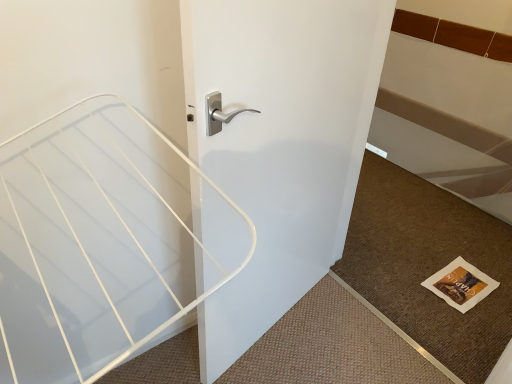
In order to face brown textured mat at lower right, should I rotate leftwards or rightwards?

To face it directly, rotate right by 19.621 degrees.

Image resolution: width=512 pixels, height=384 pixels. Describe the element at coordinates (428, 265) in the screenshot. I see `brown textured mat at lower right` at that location.

What is the approximate width of brown textured mat at lower right?

It is 3.42 feet.

Where is `brown textured mat at lower right`? This screenshot has width=512, height=384. brown textured mat at lower right is located at coordinates (428, 265).

Measure the distance between point (378, 277) and camera.

A distance of 6.25 feet exists between point (378, 277) and camera.

What is the approximate height of white glossy door handle at center?

white glossy door handle at center is 1.20 meters tall.

Find the location of `white glossy door handle at center`. white glossy door handle at center is located at coordinates (280, 144).

The height and width of the screenshot is (384, 512). What do you see at coordinates (280, 144) in the screenshot?
I see `white glossy door handle at center` at bounding box center [280, 144].

Image resolution: width=512 pixels, height=384 pixels. I want to click on brown textured mat at lower right, so (x=428, y=265).

Does brown textured mat at lower right appear on the right side of white glossy door handle at center?

Yes.

Which is in front, brown textured mat at lower right or white glossy door handle at center?

white glossy door handle at center is closer to the camera.

Considering the positions of point (389, 257) and point (288, 42), is point (389, 257) closer or farther from the camera than point (288, 42)?

Point (389, 257) is positioned farther from the camera compared to point (288, 42).

From the image's perspective, is brown textured mat at lower right above white glossy door handle at center?

No, from the image's perspective, brown textured mat at lower right is not over white glossy door handle at center.

From a real-world perspective, who is located higher, brown textured mat at lower right or white glossy door handle at center?

In real-world perspective, white glossy door handle at center is above.

Between brown textured mat at lower right and white glossy door handle at center, which one has larger width?

Wider between the two is brown textured mat at lower right.

Does brown textured mat at lower right have a lesser height compared to white glossy door handle at center?

Indeed, brown textured mat at lower right has a lesser height compared to white glossy door handle at center.

Consider the image. Which of these two, brown textured mat at lower right or white glossy door handle at center, is bigger?

Bigger between the two is white glossy door handle at center.

Can we say brown textured mat at lower right lies outside white glossy door handle at center?

Indeed, brown textured mat at lower right is completely outside white glossy door handle at center.

Is brown textured mat at lower right placed right next to white glossy door handle at center?

No.

Is brown textured mat at lower right oriented away from white glossy door handle at center?

That's not correct — brown textured mat at lower right is not looking away from white glossy door handle at center.

From the picture: How much distance is there between brown textured mat at lower right and white glossy door handle at center?

brown textured mat at lower right is 70.80 centimeters from white glossy door handle at center.

At what (x,y) coordinates should I click in order to perform the action: click on door above the brown textured mat at lower right (from the image's perspective). Please return your answer as a coordinate pair (x, y). The width and height of the screenshot is (512, 384). Looking at the image, I should click on (280, 144).

Considering the relative positions of white glossy door handle at center and brown textured mat at lower right in the image provided, is white glossy door handle at center to the left or to the right of brown textured mat at lower right?

In the image, white glossy door handle at center appears on the left side of brown textured mat at lower right.

Is the position of white glossy door handle at center less distant than that of brown textured mat at lower right?

Answer: Yes, white glossy door handle at center is closer to the camera.

Is point (203, 78) positioned before point (495, 257)?

Yes, point (203, 78) is closer to viewer.

From the image's perspective, is white glossy door handle at center located above or below brown textured mat at lower right?

Based on their image positions, white glossy door handle at center is located above brown textured mat at lower right.

From a real-world perspective, is white glossy door handle at center on brown textured mat at lower right?

Correct, in the physical world, white glossy door handle at center is higher than brown textured mat at lower right.

Considering the sizes of objects white glossy door handle at center and brown textured mat at lower right in the image provided, who is thinner, white glossy door handle at center or brown textured mat at lower right?

white glossy door handle at center is thinner.

Considering the sizes of objects white glossy door handle at center and brown textured mat at lower right in the image provided, who is shorter, white glossy door handle at center or brown textured mat at lower right?

With less height is brown textured mat at lower right.

Is white glossy door handle at center bigger than brown textured mat at lower right?

Correct, white glossy door handle at center is larger in size than brown textured mat at lower right.

Would you say white glossy door handle at center contains brown textured mat at lower right?

No, brown textured mat at lower right is not a part of white glossy door handle at center.

Does white glossy door handle at center touch brown textured mat at lower right?

No, white glossy door handle at center is not with brown textured mat at lower right.

Is white glossy door handle at center turned away from brown textured mat at lower right?

white glossy door handle at center does not have its back to brown textured mat at lower right.

What's the angular difference between white glossy door handle at center and brown textured mat at lower right's facing directions?

They differ by 102 degrees in their facing directions.

Locate an element on the screen. This screenshot has width=512, height=384. doormat below the white glossy door handle at center (from a real-world perspective) is located at coordinates (428, 265).

The image size is (512, 384). In order to click on door above the brown textured mat at lower right (from a real-world perspective) in this screenshot , I will do `click(280, 144)`.

Find the location of a particular element. The width and height of the screenshot is (512, 384). doormat lying on the right of white glossy door handle at center is located at coordinates (428, 265).